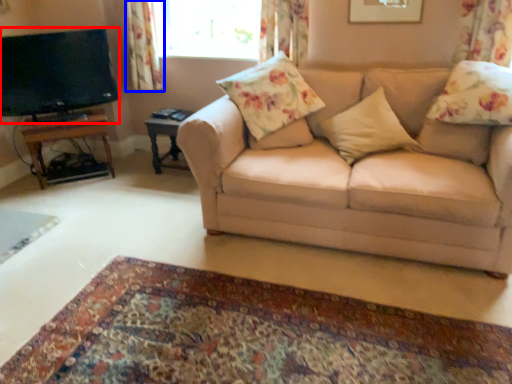
Question: Which object appears farthest to the camera in this image, television (highlighted by a red box) or curtain (highlighted by a blue box)?

Choices:
 (A) television
 (B) curtain

Answer: (B)